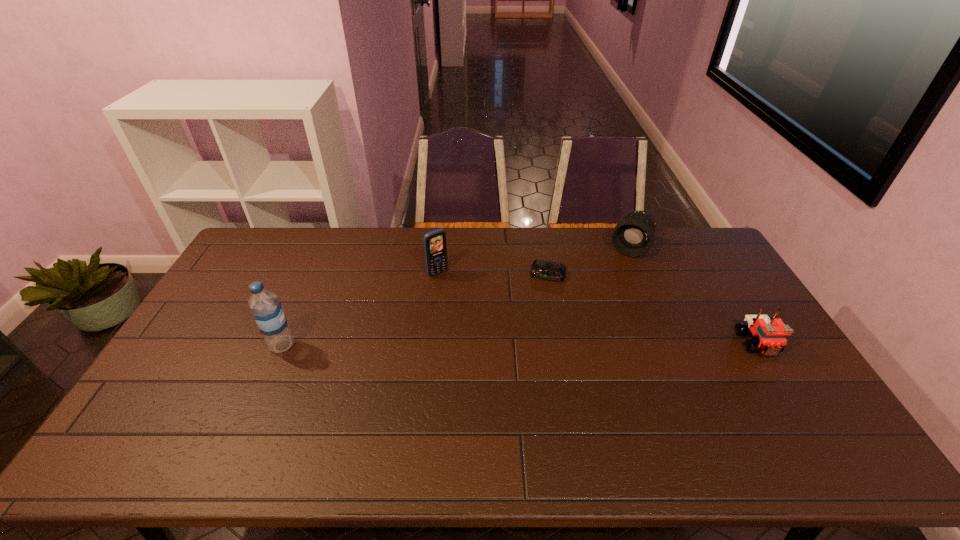
Identify the location of free space located 0.270m at the front element of the farthest object. pos(601,306).

At what (x,y) coordinates should I click in order to perform the action: click on alarm clock present at the far edge. Please return your answer as a coordinate pair (x, y). Image resolution: width=960 pixels, height=540 pixels. Looking at the image, I should click on (541, 269).

This screenshot has height=540, width=960. I want to click on telephoto lens situated at the far edge, so click(633, 236).

Identify the location of object present at the right edge. This screenshot has width=960, height=540. (768, 334).

What are the coordinates of `vacant space at the far edge of the desktop` in the screenshot? It's located at (396, 245).

Locate an element on the screen. This screenshot has width=960, height=540. free region at the near edge of the desktop is located at coordinates (247, 396).

Find the location of `vacant space at the left edge`. vacant space at the left edge is located at coordinates (187, 381).

Find the location of a particular element. This screenshot has width=960, height=540. free space at the right edge is located at coordinates (699, 285).

Image resolution: width=960 pixels, height=540 pixels. In order to click on blank space at the far left corner in this screenshot , I will do `click(257, 252)`.

Identify the location of vacant space at the far right corner. The height and width of the screenshot is (540, 960). (716, 253).